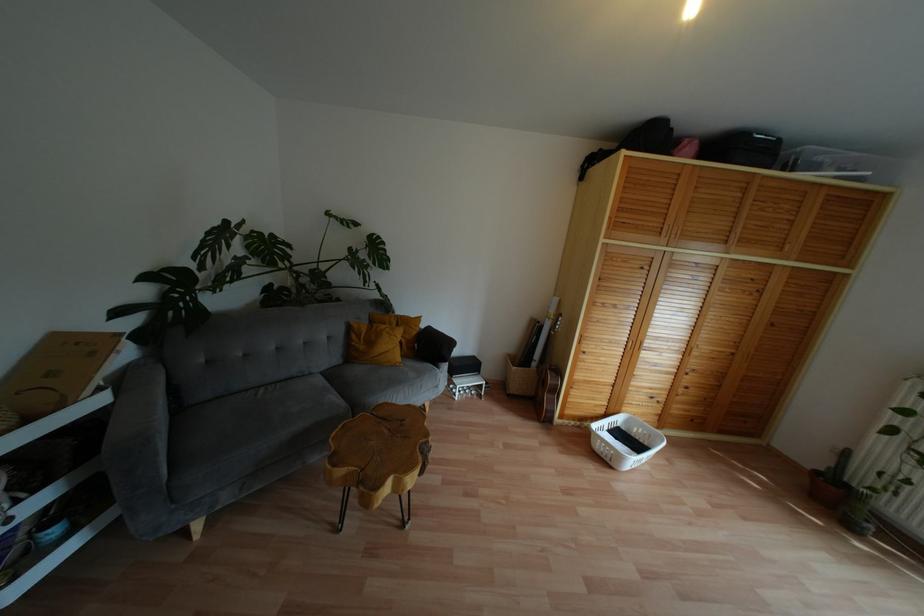
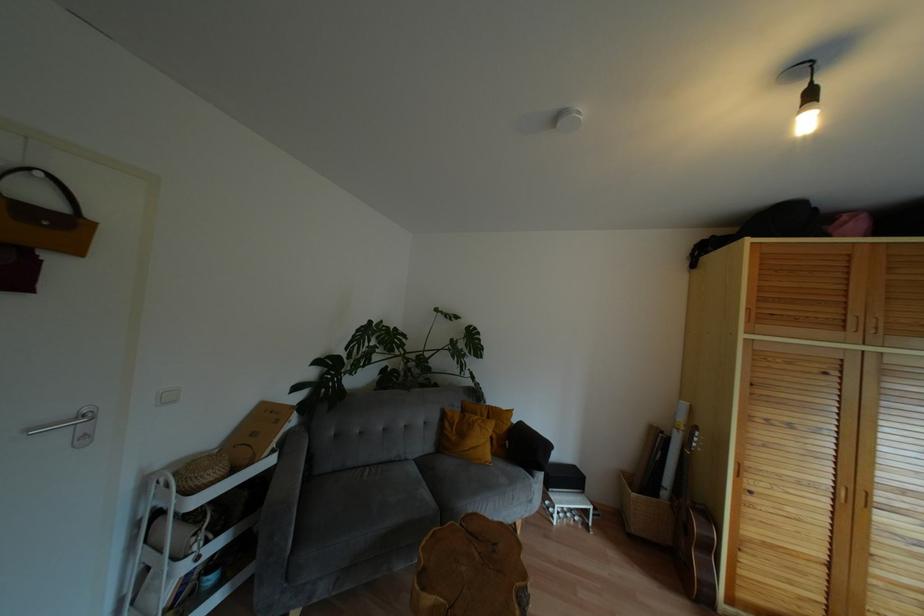
In the second image, find the point that corresponds to point (116, 382) in the first image.

(282, 446)